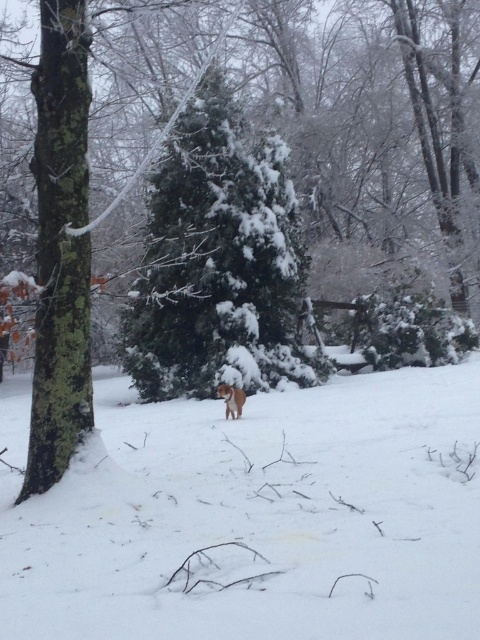
Does green textured evergreen tree at center appear on the right side of fuzzy brown dog at center?

In fact, green textured evergreen tree at center is to the left of fuzzy brown dog at center.

You are a GUI agent. You are given a task and a screenshot of the screen. Output one action in this format:
    pyautogui.click(x=<x>, y=<y>)
    Task: Click on the green textured evergreen tree at center
    
    Given the screenshot: What is the action you would take?
    pyautogui.click(x=217, y=260)

Locate an element on the screen. green textured evergreen tree at center is located at coordinates (217, 260).

Which is in front, point (3, 554) or point (186, 378)?

Point (3, 554) is in front.

Image resolution: width=480 pixels, height=640 pixels. What do you see at coordinates (257, 516) in the screenshot? I see `white fluffy snow at center` at bounding box center [257, 516].

The height and width of the screenshot is (640, 480). In order to click on white fluffy snow at center in this screenshot , I will do `click(257, 516)`.

This screenshot has width=480, height=640. Identify the location of white fluffy snow at center. (257, 516).

Between point (248, 536) and point (220, 381), which one is positioned behind?

The point (220, 381) is behind.

Locate an element on the screen. The width and height of the screenshot is (480, 640). white fluffy snow at center is located at coordinates (257, 516).

Where is `white fluffy snow at center`? white fluffy snow at center is located at coordinates (257, 516).